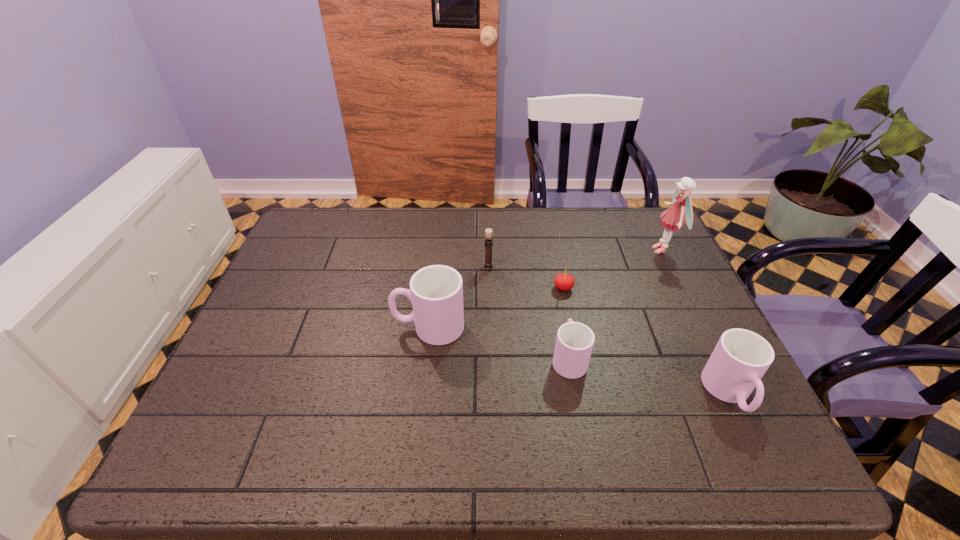
All cups are currently evenly spaced. To continue this pattern, where would you add another cup on the left? Please point out a vacant spot. Please provide its 2D coordinates. Your answer should be formatted as a tuple, i.e. [(x, y)], where the tuple contains the x and y coordinates of a point satisfying the conditions above.

[(305, 300)]